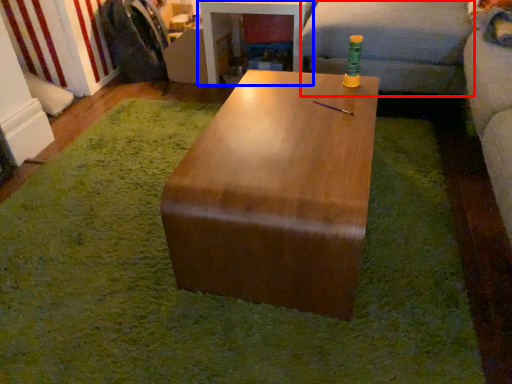
Question: Which of the following is the farthest to the observer, couch (highlighted by a red box) or table (highlighted by a blue box)?

Choices:
 (A) couch
 (B) table

Answer: (B)